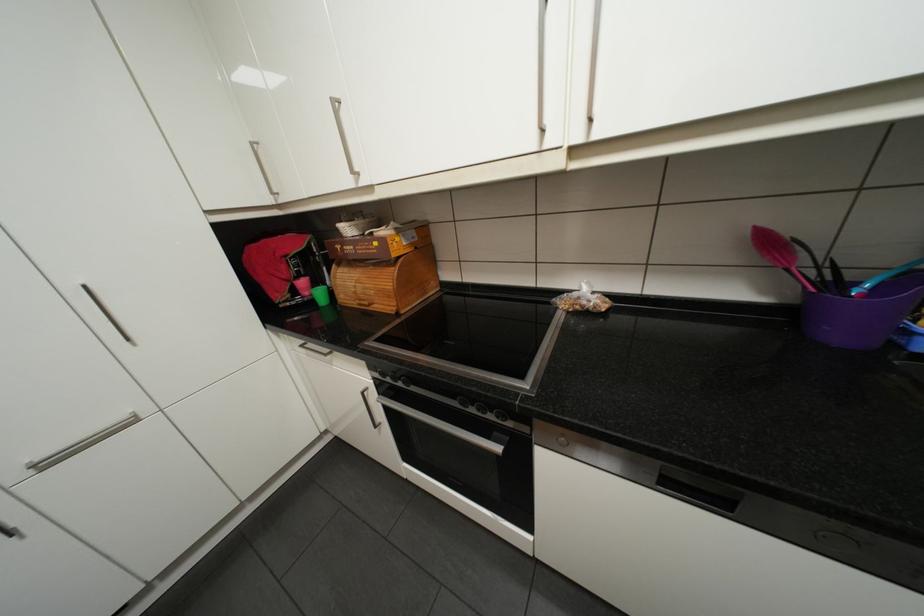
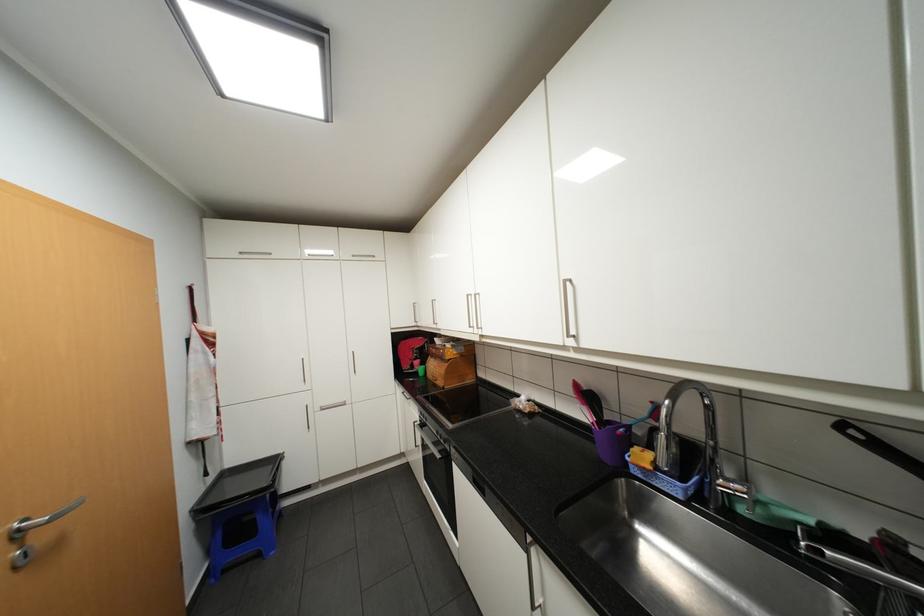
The point at (252, 193) is marked in the first image. Where is the corresponding point in the second image?

(412, 322)